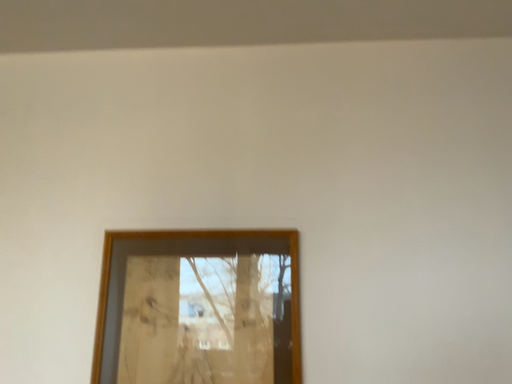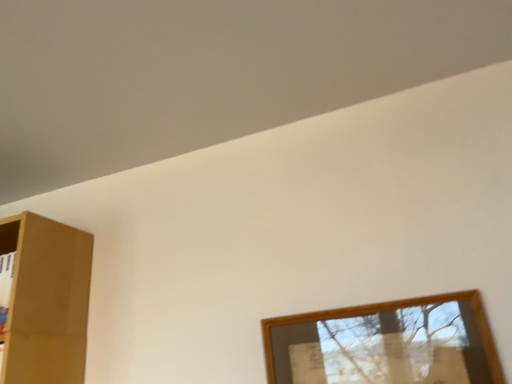
Question: Which way did the camera rotate in the video?

Choices:
 (A) rotated left
 (B) rotated right

Answer: (A)